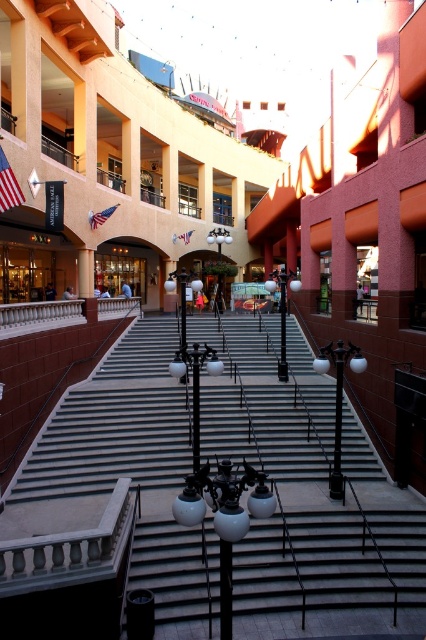
Question: Is white marble stairs at center above american flag at upper left?

Choices:
 (A) no
 (B) yes

Answer: (A)

Question: Can you confirm if white marble stairs at center is positioned to the left of american flag at upper center?

Choices:
 (A) yes
 (B) no

Answer: (B)

Question: Which of these objects is positioned farthest from the white marble stairs at center?

Choices:
 (A) american flag at upper center
 (B) american flag at upper left

Answer: (A)

Question: Is white marble stairs at center behind american flag at upper left?

Choices:
 (A) yes
 (B) no

Answer: (B)

Question: Which point appears farthest from the camera in this image?

Choices:
 (A) (104, 212)
 (B) (0, 188)
 (C) (80, 541)

Answer: (A)

Question: Which of the following is the closest to the observer?

Choices:
 (A) white marble stairs at center
 (B) american flag at upper left

Answer: (A)